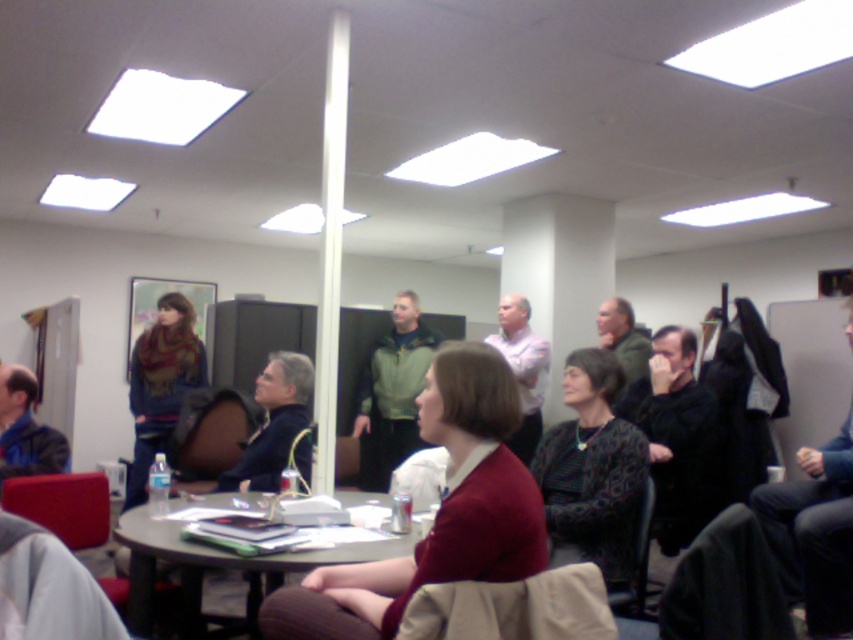
Question: Does maroon sweater at center appear on the right side of wooden table at center?

Choices:
 (A) no
 (B) yes

Answer: (B)

Question: Can you confirm if maroon sweater at center is smaller than wooden table at center?

Choices:
 (A) no
 (B) yes

Answer: (B)

Question: Which object is farther from the camera taking this photo?

Choices:
 (A) maroon sweater at center
 (B) wooden table at center

Answer: (B)

Question: Is maroon sweater at center to the right of wooden table at center from the viewer's perspective?

Choices:
 (A) no
 (B) yes

Answer: (B)

Question: Which object is farther from the camera taking this photo?

Choices:
 (A) wooden table at center
 (B) maroon sweater at center

Answer: (A)